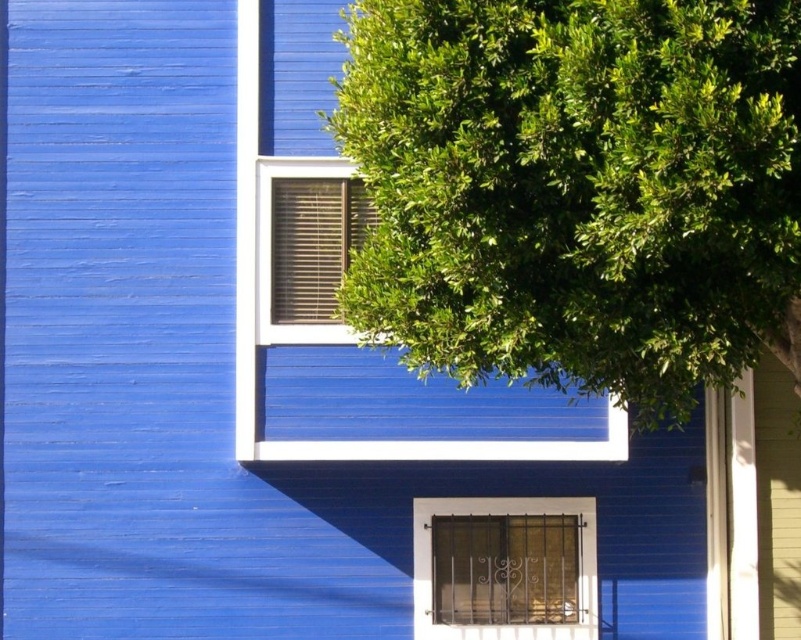
You are standing in front of the building with the blue wooden facade. There is a point marked at coordinates (578,189). What does this point indicate?

The point at coordinates (578,189) indicates the green leafy tree at upper right.

Based on the photo, you are standing in front of the building and notice the green leafy tree at upper right and the matte brown blinds at upper center. Which object is located higher up on the building?

The green leafy tree at upper right is positioned over the matte brown blinds at upper center, so it is located higher up on the building.